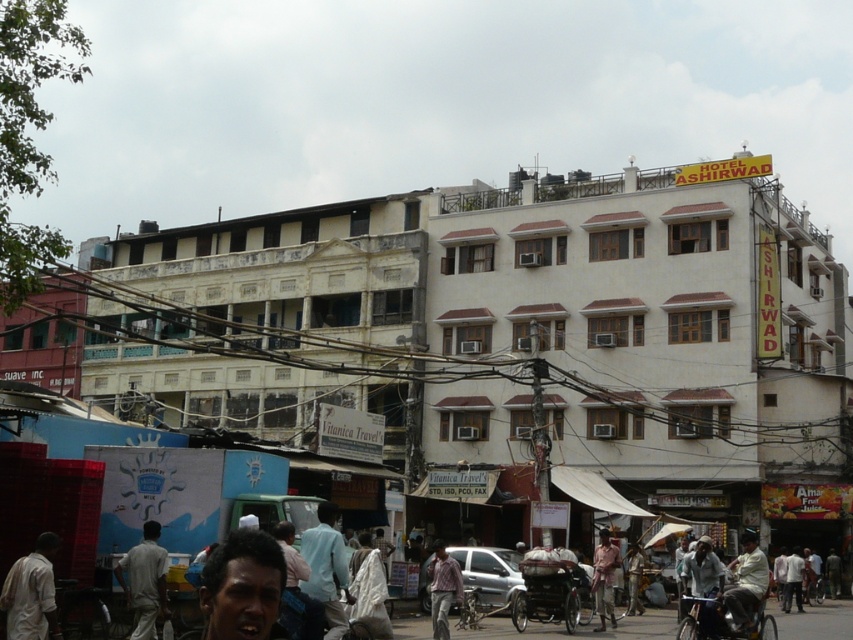
Question: Is white cotton shirt at lower left further to the viewer compared to light blue fabric shirt at center?

Choices:
 (A) no
 (B) yes

Answer: (A)

Question: Which is nearer to the light blue shirt at center?

Choices:
 (A) light brown fabric shirt at lower center
 (B) light blue fabric shirt at center

Answer: (A)

Question: Does dark skin face at lower center have a smaller size compared to light blue fabric shirt at center?

Choices:
 (A) yes
 (B) no

Answer: (A)

Question: Which object is closer to the camera taking this photo?

Choices:
 (A) plaid shirt at center
 (B) light brown fabric shirt at lower center

Answer: (A)

Question: Which of the following is the closest to the observer?

Choices:
 (A) (701, 589)
 (B) (195, 250)
 (C) (143, 609)
 (D) (610, 596)

Answer: (C)

Question: Does light beige fabric shirt at center lie in front of light blue fabric shirt at center?

Choices:
 (A) yes
 (B) no

Answer: (A)